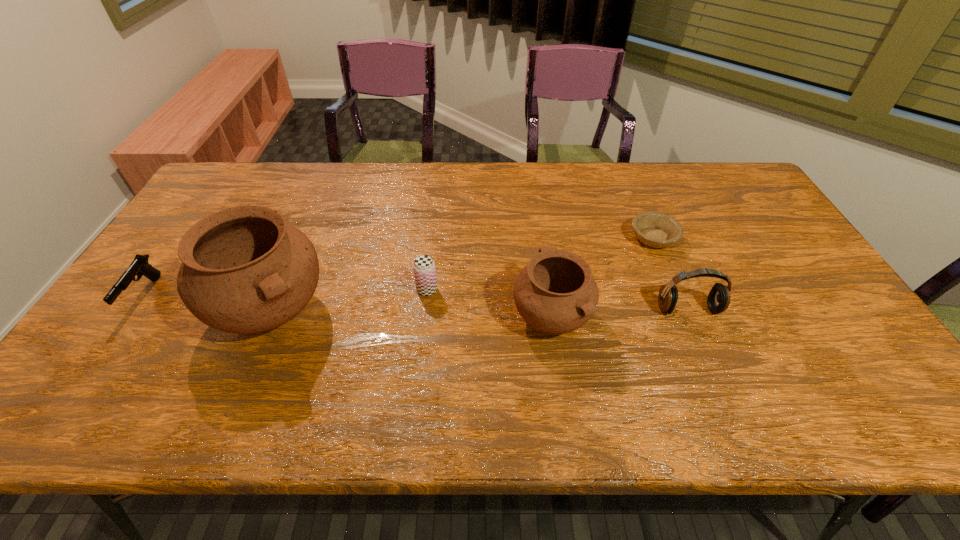
Where is `free space between the leftmost object and the shortest object`? The height and width of the screenshot is (540, 960). free space between the leftmost object and the shortest object is located at coordinates (398, 267).

At what (x,y) coordinates should I click in order to perform the action: click on free space between the headset and the shortest object. Please return your answer as a coordinate pair (x, y). The height and width of the screenshot is (540, 960). Looking at the image, I should click on (670, 274).

Find the location of a particular element. vacant area that lies between the bowl and the headset is located at coordinates (670, 274).

Locate an element on the screen. free area in between the fifth object from right to left and the fourth shortest object is located at coordinates (480, 308).

Find the location of a particular element. This screenshot has height=540, width=960. vacant area between the headset and the second tallest object is located at coordinates (619, 312).

You are a GUI agent. You are given a task and a screenshot of the screen. Output one action in this format:
    pyautogui.click(x=<x>, y=<y>)
    Task: Click on the vacant space in between the taller pottery and the farthest object
    The height and width of the screenshot is (540, 960).
    Given the screenshot: What is the action you would take?
    pyautogui.click(x=463, y=273)

The height and width of the screenshot is (540, 960). Identify the location of free spot between the gun and the third object from right to left. (348, 306).

Identify the location of free space between the farthest object and the taller pottery. The image size is (960, 540). (463, 273).

In order to click on free space between the third tallest object and the shorter pottery in this screenshot , I will do `click(619, 312)`.

The height and width of the screenshot is (540, 960). What are the coordinates of `vacant space in between the headset and the fifth object from right to left` in the screenshot? It's located at (480, 308).